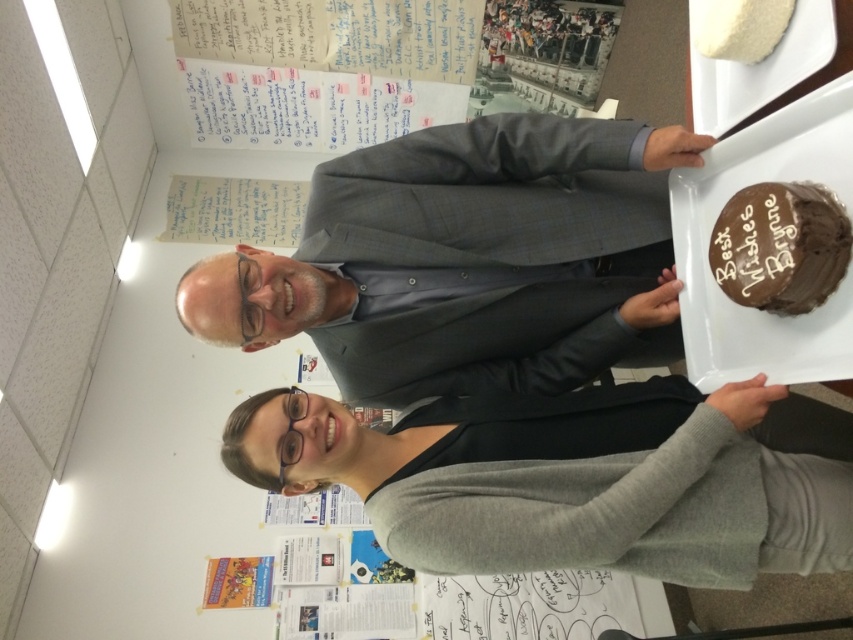
Question: Which of the following is the farthest from the observer?

Choices:
 (A) matte gray suit at center
 (B) chocolatesmoothcake at right

Answer: (A)

Question: Observing the image, what is the correct spatial positioning of matte gray suit at center in reference to gray woolen business suit at center?

Choices:
 (A) right
 (B) left

Answer: (B)

Question: Which point appears closest to the camera in this image?

Choices:
 (A) (538, 474)
 (B) (781, 243)

Answer: (B)

Question: Considering the relative positions of matte gray suit at center and chocolatesmoothcake at right in the image provided, where is matte gray suit at center located with respect to chocolatesmoothcake at right?

Choices:
 (A) left
 (B) right

Answer: (A)

Question: Which object is farther from the camera taking this photo?

Choices:
 (A) matte gray suit at center
 (B) gray woolen business suit at center
 (C) chocolatesmoothcake at right

Answer: (A)

Question: Is gray woolen business suit at center to the left of chocolatesmoothcake at right from the viewer's perspective?

Choices:
 (A) no
 (B) yes

Answer: (B)